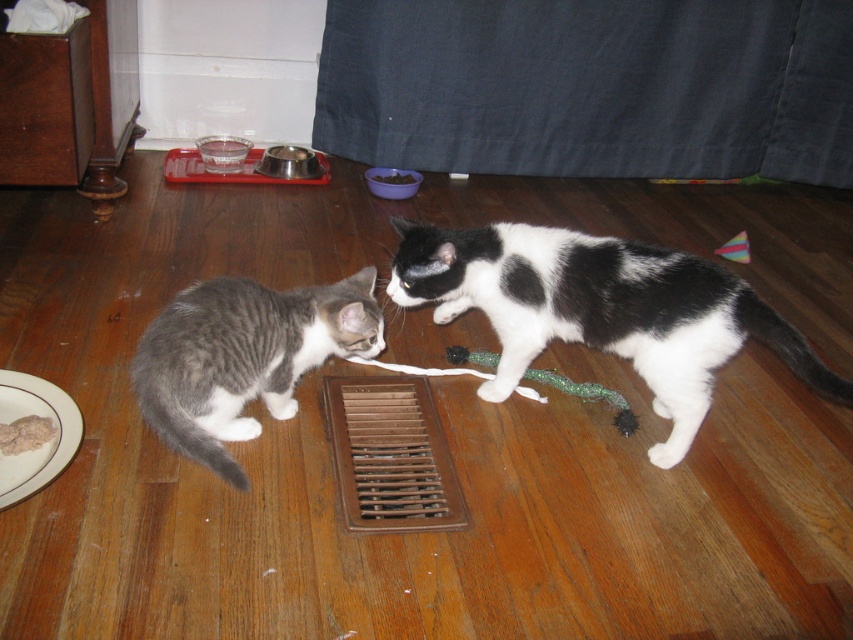
Question: Can you confirm if black and white fur at center is positioned below gray tabby cat at lower left?

Choices:
 (A) yes
 (B) no

Answer: (B)

Question: Which object appears farthest from the camera in this image?

Choices:
 (A) black and white fur at center
 (B) gray tabby cat at lower left

Answer: (A)

Question: Is black and white fur at center behind gray tabby cat at lower left?

Choices:
 (A) yes
 (B) no

Answer: (A)

Question: Does black and white fur at center appear under gray tabby cat at lower left?

Choices:
 (A) yes
 (B) no

Answer: (B)

Question: Which point is closer to the camera taking this photo?

Choices:
 (A) (x=494, y=388)
 (B) (x=231, y=396)

Answer: (B)

Question: Which point is closer to the camera?

Choices:
 (A) black and white fur at center
 (B) gray tabby cat at lower left

Answer: (B)